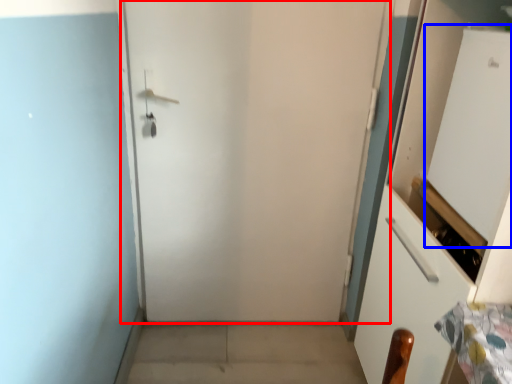
Question: Which of the following is the farthest to the observer, door (highlighted by a red box) or screen door (highlighted by a blue box)?

Choices:
 (A) door
 (B) screen door

Answer: (A)